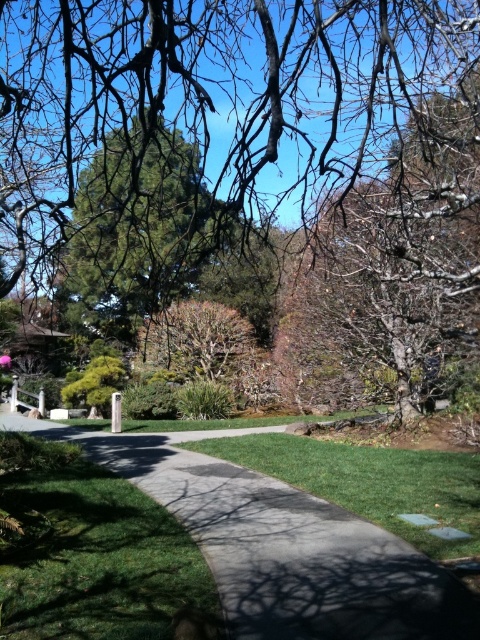
Is gray concrete pavement at center bigger than green grass at lower left?

Indeed, gray concrete pavement at center has a larger size compared to green grass at lower left.

Is point (142, 454) positioned before point (126, 529)?

No.

You are a GUI agent. You are given a task and a screenshot of the screen. Output one action in this format:
    pyautogui.click(x=<x>, y=<y>)
    Task: Click on the gray concrete pavement at center
    Image resolution: width=480 pixels, height=640 pixels.
    Given the screenshot: What is the action you would take?
    pyautogui.click(x=282, y=545)

Can you confirm if green grass at lower left is positioned below green grass at center?

Actually, green grass at lower left is above green grass at center.

Is green grass at lower left thinner than green grass at center?

Incorrect, green grass at lower left's width is not less than green grass at center's.

Which is in front, point (108, 513) or point (340, 486)?

Point (108, 513) is in front.

This screenshot has width=480, height=640. Identify the location of green grass at lower left. (98, 561).

Consider the image. Which of these two, gray concrete pavement at center or green grass at center, stands taller?

With more height is gray concrete pavement at center.

Who is more forward, (x=351, y=531) or (x=389, y=460)?

Point (x=351, y=531) is in front.

You are a GUI agent. You are given a task and a screenshot of the screen. Output one action in this format:
    pyautogui.click(x=<x>, y=<y>)
    Task: Click on the gray concrete pavement at center
    This screenshot has width=480, height=640.
    Given the screenshot: What is the action you would take?
    pyautogui.click(x=282, y=545)